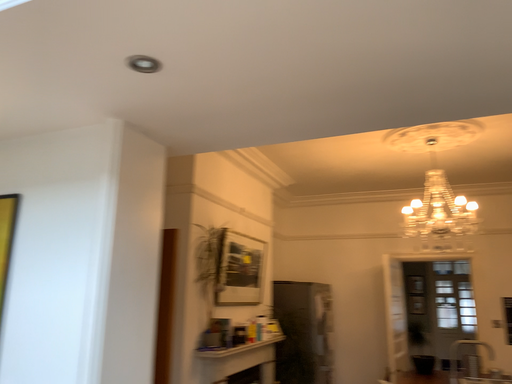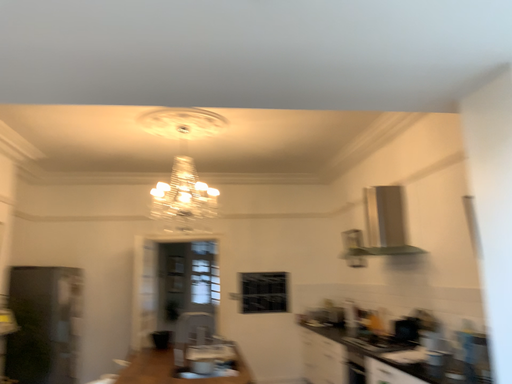
Question: Which way did the camera rotate in the video?

Choices:
 (A) rotated right
 (B) rotated left

Answer: (A)